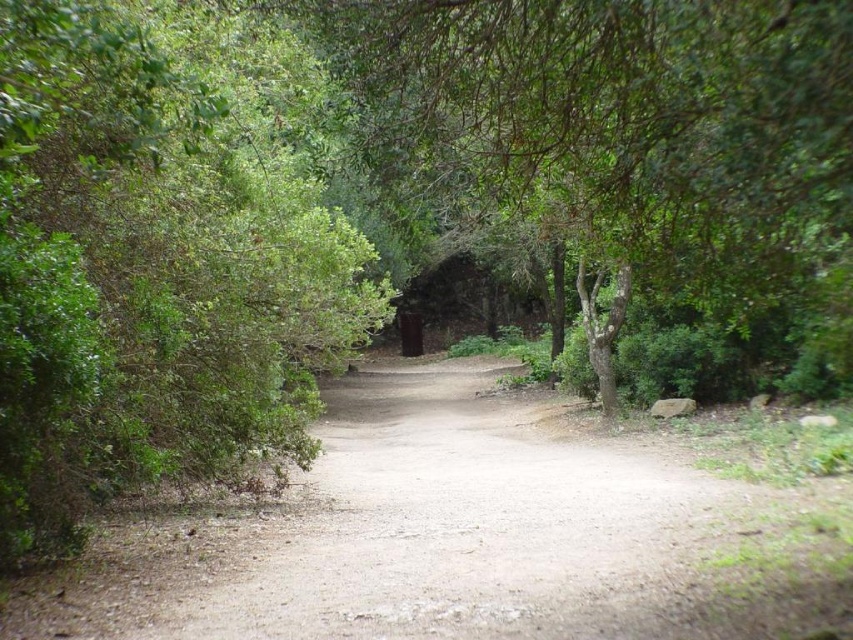
You are standing at the center of the dirt path in the forest. You notice a green leafy bush at left. Based on its position, can you determine if it is closer to the front or the back of the image?

The green leafy bush at left is located at point [160,257], which places it closer to the front of the image since lower y coordinates typically indicate positions closer to the viewer in such coordinate systems.

You are a hiker standing at the starting point of the dirt path in the forest. You see two points marked on your map corresponding to coordinates point [260,28] and point [659,598]. Which point is closer to you?

Point [260,28] is closer to you since it is further to the viewer than point [659,598], meaning it lies nearer in the scene.